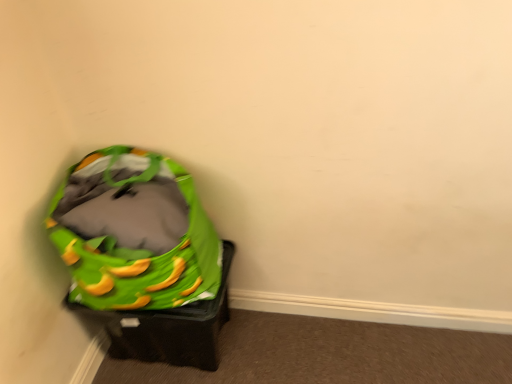
Question: From a real-world perspective, is green fabric bean bag chair at left located higher than green fabric bag at lower left?

Choices:
 (A) no
 (B) yes

Answer: (B)

Question: Is there a large distance between green fabric bean bag chair at left and green fabric bag at lower left?

Choices:
 (A) no
 (B) yes

Answer: (A)

Question: Does green fabric bean bag chair at left come in front of green fabric bag at lower left?

Choices:
 (A) yes
 (B) no

Answer: (A)

Question: Is green fabric bean bag chair at left to the left of green fabric bag at lower left from the viewer's perspective?

Choices:
 (A) yes
 (B) no

Answer: (A)

Question: Is green fabric bean bag chair at left placed right next to green fabric bag at lower left?

Choices:
 (A) yes
 (B) no

Answer: (B)

Question: From the image's perspective, is green fabric bean bag chair at left above green fabric bag at lower left?

Choices:
 (A) yes
 (B) no

Answer: (A)

Question: Does green fabric bag at lower left touch green fabric bean bag chair at left?

Choices:
 (A) no
 (B) yes

Answer: (A)

Question: From a real-world perspective, is green fabric bag at lower left beneath green fabric bean bag chair at left?

Choices:
 (A) yes
 (B) no

Answer: (A)

Question: Considering the relative positions of green fabric bag at lower left and green fabric bean bag chair at left in the image provided, is green fabric bag at lower left to the left of green fabric bean bag chair at left from the viewer's perspective?

Choices:
 (A) no
 (B) yes

Answer: (A)

Question: Does green fabric bag at lower left have a greater width compared to green fabric bean bag chair at left?

Choices:
 (A) yes
 (B) no

Answer: (B)

Question: Is green fabric bean bag chair at left completely or partially inside green fabric bag at lower left?

Choices:
 (A) yes
 (B) no

Answer: (B)

Question: Can we say green fabric bag at lower left lies outside green fabric bean bag chair at left?

Choices:
 (A) yes
 (B) no

Answer: (A)

Question: Is point [x=208, y=253] positioned closer to the camera than point [x=181, y=324]?

Choices:
 (A) closer
 (B) farther

Answer: (A)